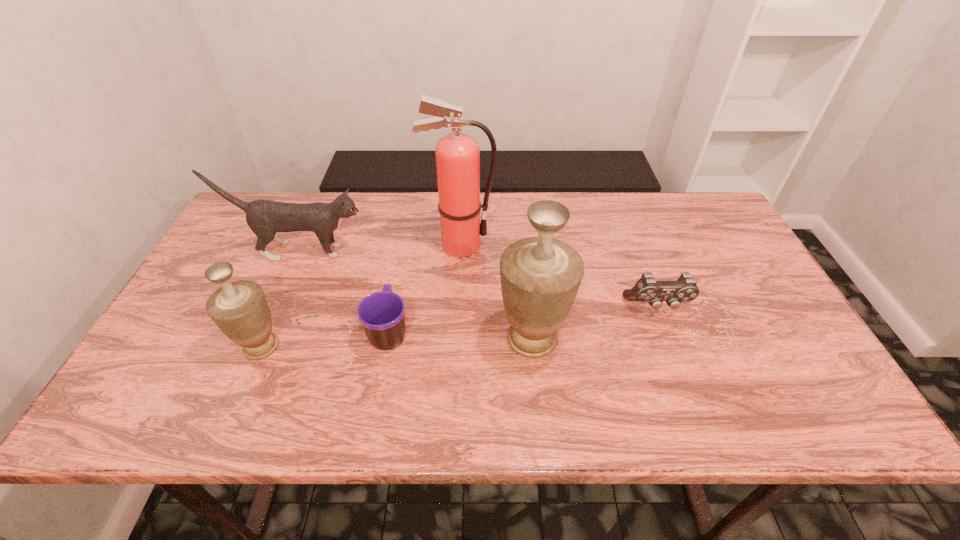
Image resolution: width=960 pixels, height=540 pixels. Identify the location of vacant space located on the surface of the rightmost object with buttons. (668, 333).

Where is `vacant region located 0.060m on the hose direction of the fire extinguisher`? vacant region located 0.060m on the hose direction of the fire extinguisher is located at coordinates (515, 245).

Image resolution: width=960 pixels, height=540 pixels. Identify the location of vacant area situated with the handle on the side of the third object from left to right. (398, 280).

At what (x,y) coordinates should I click in order to perform the action: click on free region located with the handle on the side of the third object from left to right. Please return your answer as a coordinate pair (x, y). This screenshot has height=540, width=960. Looking at the image, I should click on (x=403, y=255).

Locate an element on the screen. This screenshot has height=540, width=960. free space located with the handle on the side of the third object from left to right is located at coordinates (401, 263).

Identify the location of object that is at the far edge. This screenshot has height=540, width=960. (457, 154).

Where is `mug that is at the near edge`? This screenshot has width=960, height=540. mug that is at the near edge is located at coordinates (382, 314).

You are a GUI agent. You are given a task and a screenshot of the screen. Output one action in this format:
    pyautogui.click(x=<x>, y=<y>)
    Task: Click on the object at the left edge
    The height and width of the screenshot is (540, 960).
    Given the screenshot: What is the action you would take?
    pyautogui.click(x=265, y=218)

Where is `free space at the far edge`? The height and width of the screenshot is (540, 960). free space at the far edge is located at coordinates (589, 200).

Locate an element on the screen. free spot at the near edge of the desktop is located at coordinates (523, 381).